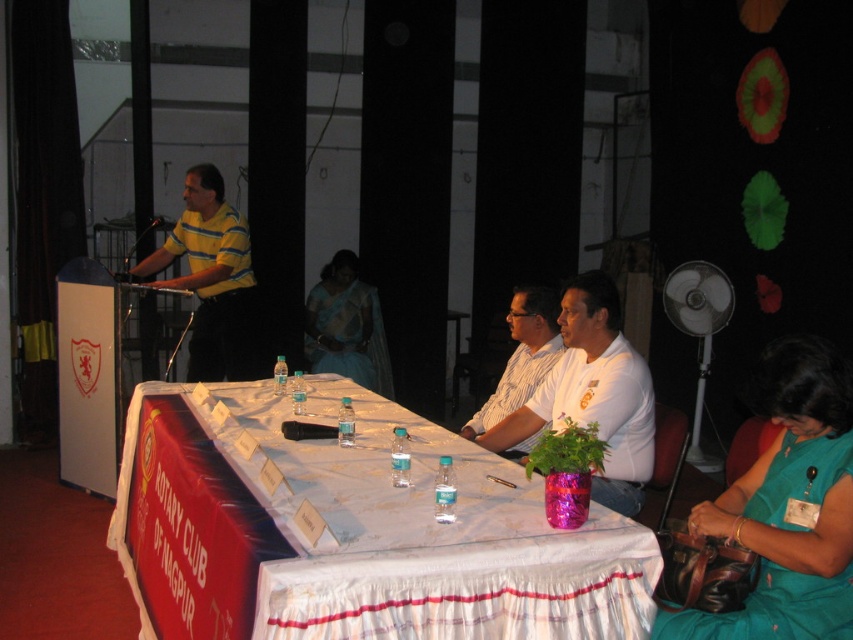
Is teal fabric dress at lower right to the left of silk sari at center from the viewer's perspective?

In fact, teal fabric dress at lower right is to the right of silk sari at center.

Does teal fabric dress at lower right have a greater height compared to silk sari at center?

No.

The height and width of the screenshot is (640, 853). Describe the element at coordinates (788, 506) in the screenshot. I see `teal fabric dress at lower right` at that location.

Where is `teal fabric dress at lower right`? This screenshot has width=853, height=640. teal fabric dress at lower right is located at coordinates (788, 506).

Is teal fabric dress at lower right smaller than white striped shirt at center?

Yes.

Can you confirm if teal fabric dress at lower right is positioned to the left of white striped shirt at center?

No, teal fabric dress at lower right is not to the left of white striped shirt at center.

Find the location of `teal fabric dress at lower right`. teal fabric dress at lower right is located at coordinates (788, 506).

Which is above, white cloth-covered table at center or silk sari at center?

silk sari at center is higher up.

Does white cloth-covered table at center have a greater width compared to silk sari at center?

Yes.

You are a GUI agent. You are given a task and a screenshot of the screen. Output one action in this format:
    pyautogui.click(x=<x>, y=<y>)
    Task: Click on the white cloth-covered table at center
    
    Given the screenshot: What is the action you would take?
    pyautogui.click(x=358, y=532)

Image resolution: width=853 pixels, height=640 pixels. I want to click on white cloth-covered table at center, so click(x=358, y=532).